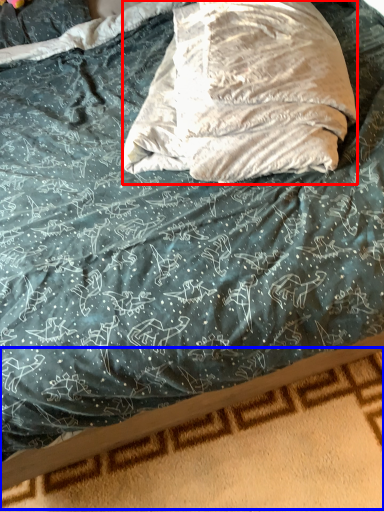
Question: Which point is closer to the camera, throw pillow (highlighted by a red box) or bed frame (highlighted by a blue box)?

Choices:
 (A) throw pillow
 (B) bed frame

Answer: (A)